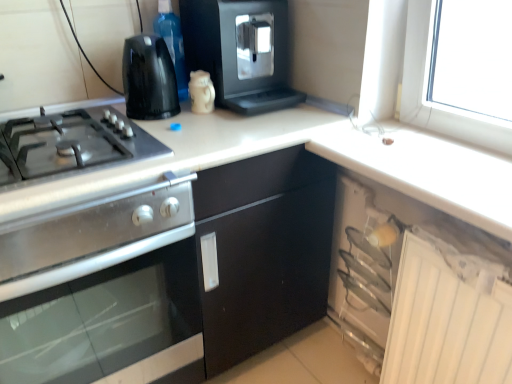
Question: Choose the correct answer: Is white plastic cabinet at lower right inside white glossy mug at upper center, which ranks as the 2th kitchen appliance in bottom-to-top order, or outside it?

Choices:
 (A) inside
 (B) outside

Answer: (B)

Question: Considering the positions of white plastic cabinet at lower right and white glossy mug at upper center, which ranks as the 2th kitchen appliance in bottom-to-top order, in the image, is white plastic cabinet at lower right taller or shorter than white glossy mug at upper center, which ranks as the 2th kitchen appliance in bottom-to-top order,?

Choices:
 (A) short
 (B) tall

Answer: (B)

Question: Based on their relative distances, which object is nearer to the white plastic cabinet at lower right?

Choices:
 (A) stainless steel oven at left, the fourth kitchen appliance from the top
 (B) black plastic kettle at upper left, arranged as the 2th kitchen appliance when viewed from the top
 (C) satin silver gas stove at left
 (D) white glossy counter top at upper right
 (E) white glossy mug at upper center, which ranks as the 2th kitchen appliance in bottom-to-top order

Answer: (D)

Question: Estimate the real-world distances between objects in this image. Which object is closer to the black plastic coffee machine at upper center, positioned as the 4th kitchen appliance in bottom-to-top order?

Choices:
 (A) white glossy mug at upper center, which ranks as the 2th kitchen appliance in bottom-to-top order
 (B) transparent plastic bottle at upper center
 (C) black plastic kettle at upper left, arranged as the 2th kitchen appliance when viewed from the top
 (D) white plastic cabinet at lower right
 (E) satin silver gas stove at left

Answer: (A)